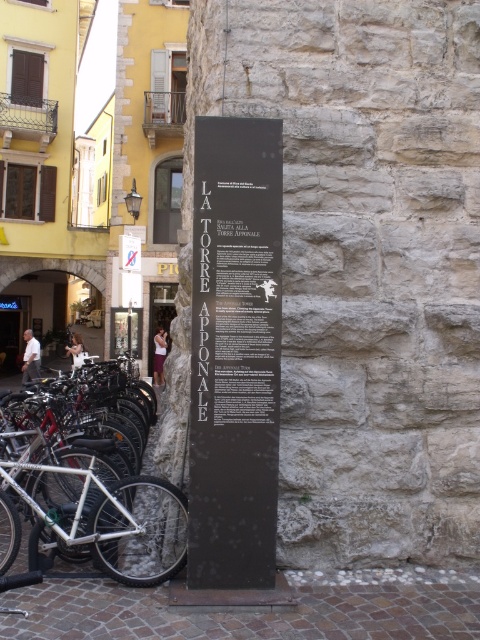
Question: Does black polished stone sign at center appear on the right side of silver metallic bicycle at left?

Choices:
 (A) no
 (B) yes

Answer: (B)

Question: Among these objects, which one is farthest from the camera?

Choices:
 (A) silver metallic bicycle at left
 (B) black polished stone sign at center

Answer: (A)

Question: Can you confirm if black polished stone sign at center is positioned to the left of silver metallic bicycle at left?

Choices:
 (A) no
 (B) yes

Answer: (A)

Question: Which point is farther to the camera?

Choices:
 (A) silver metallic bicycle at left
 (B) black polished stone sign at center

Answer: (A)

Question: Does black polished stone sign at center have a greater width compared to silver metallic bicycle at left?

Choices:
 (A) yes
 (B) no

Answer: (B)